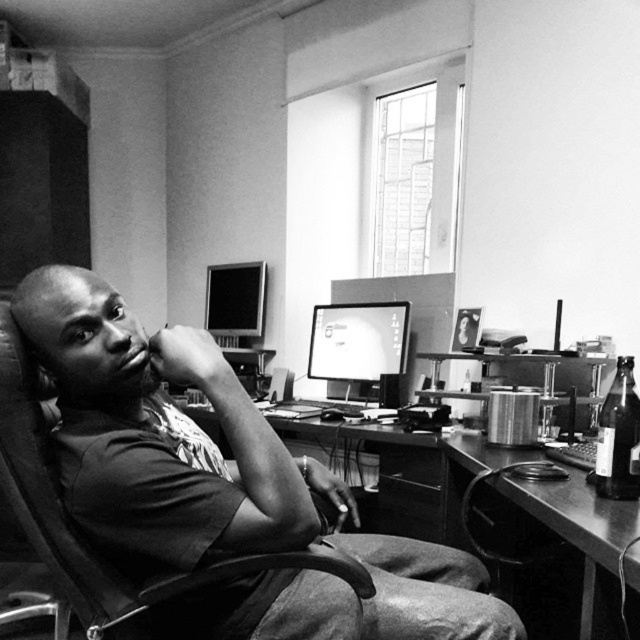
Question: Which of these objects is positioned closest to the matte plastic monitor at center?

Choices:
 (A) smooth cotton shirt at center
 (B) metallic desk at lower right
 (C) translucent glass bottle at right
 (D) matte black monitor at upper center

Answer: (D)

Question: Is translucent glass bottle at right closer to the viewer compared to matte black monitor at upper center?

Choices:
 (A) no
 (B) yes

Answer: (B)

Question: Which of the following is the closest to the observer?

Choices:
 (A) matte plastic monitor at center
 (B) metallic desk at center
 (C) smooth cotton shirt at center

Answer: (B)

Question: Is metallic desk at center closer to the viewer compared to matte plastic monitor at center?

Choices:
 (A) yes
 (B) no

Answer: (A)

Question: Which point is farther to the camera?

Choices:
 (A) (228, 268)
 (B) (634, 563)
 (C) (284, 483)

Answer: (A)

Question: Is metallic desk at lower right bigger than metallic desk at center?

Choices:
 (A) no
 (B) yes

Answer: (A)